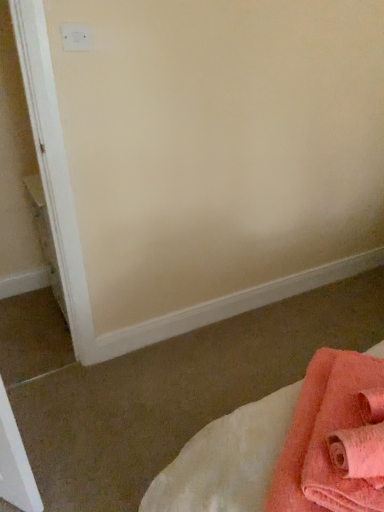
In order to click on soft coral towel at lower right in this screenshot , I will do `click(325, 438)`.

What is the approximate width of soft pink towel at lower right?

soft pink towel at lower right is 11.96 inches wide.

The width and height of the screenshot is (384, 512). In order to click on white plastic electric outlet at upper left in this screenshot , I will do `click(75, 37)`.

Does soft pink towel at lower right appear on the left side of soft coral towel at lower right?

No.

Considering the relative sizes of soft pink towel at lower right and soft coral towel at lower right in the image provided, is soft pink towel at lower right smaller than soft coral towel at lower right?

Correct, soft pink towel at lower right occupies less space than soft coral towel at lower right.

In the scene shown: From a real-world perspective, is soft pink towel at lower right physically above soft coral towel at lower right?

Indeed, from a real-world perspective, soft pink towel at lower right stands above soft coral towel at lower right.

Would you say soft pink towel at lower right is inside or outside soft coral towel at lower right?

soft pink towel at lower right is not enclosed by soft coral towel at lower right.

This screenshot has width=384, height=512. In order to click on towel in front of the white plastic electric outlet at upper left in this screenshot , I will do `click(325, 438)`.

From the image's perspective, between soft coral towel at lower right and white plastic electric outlet at upper left, who is located below?

soft coral towel at lower right is shown below in the image.

Does soft coral towel at lower right turn towards white plastic electric outlet at upper left?

No, soft coral towel at lower right does not turn towards white plastic electric outlet at upper left.

Does white plastic electric outlet at upper left have a greater height compared to soft coral towel at lower right?

No.

From a real-world perspective, is white plastic electric outlet at upper left on soft coral towel at lower right?

Yes, from a real-world perspective, white plastic electric outlet at upper left is above soft coral towel at lower right.

Considering their positions, is white plastic electric outlet at upper left located in front of or behind soft coral towel at lower right?

Clearly, white plastic electric outlet at upper left is behind soft coral towel at lower right.

I want to click on towel in front of the white plastic electric outlet at upper left, so click(325, 438).

In terms of size, does soft pink towel at lower right appear bigger or smaller than white plastic electric outlet at upper left?

In the image, soft pink towel at lower right appears to be larger than white plastic electric outlet at upper left.

Who is shorter, soft pink towel at lower right or white plastic electric outlet at upper left?

soft pink towel at lower right is shorter.

Is soft pink towel at lower right outside of white plastic electric outlet at upper left?

Absolutely, soft pink towel at lower right is external to white plastic electric outlet at upper left.

From a real-world perspective, who is located higher, soft coral towel at lower right or soft pink towel at lower right?

In real-world perspective, soft pink towel at lower right is above.

Between point (347, 509) and point (382, 451), which one is positioned behind?

The point (347, 509) is farther.

Considering the relative sizes of soft coral towel at lower right and soft pink towel at lower right in the image provided, is soft coral towel at lower right bigger than soft pink towel at lower right?

Indeed, soft coral towel at lower right has a larger size compared to soft pink towel at lower right.

Which of these two, soft coral towel at lower right or soft pink towel at lower right, stands shorter?

Standing shorter between the two is soft pink towel at lower right.

From a real-world perspective, is white plastic electric outlet at upper left over soft pink towel at lower right?

Yes, from a real-world perspective, white plastic electric outlet at upper left is on top of soft pink towel at lower right.

Could you tell me if white plastic electric outlet at upper left is facing soft pink towel at lower right?

Yes, white plastic electric outlet at upper left faces towards soft pink towel at lower right.

From the picture: From the image's perspective, is white plastic electric outlet at upper left positioned above or below soft pink towel at lower right?

Clearly, from the image's perspective, white plastic electric outlet at upper left is above soft pink towel at lower right.

What's the angular difference between white plastic electric outlet at upper left and soft pink towel at lower right's facing directions?

white plastic electric outlet at upper left and soft pink towel at lower right are facing 107 degrees away from each other.

Locate an element on the screen. The image size is (384, 512). bath towel above the soft coral towel at lower right (from the image's perspective) is located at coordinates (358, 451).

You are a GUI agent. You are given a task and a screenshot of the screen. Output one action in this format:
    pyautogui.click(x=<x>, y=<y>)
    Task: Click on the towel in front of the white plastic electric outlet at upper left
    This screenshot has width=384, height=512.
    Given the screenshot: What is the action you would take?
    pyautogui.click(x=325, y=438)

In the scene shown: When comparing their distances from soft coral towel at lower right, does soft pink towel at lower right or white plastic electric outlet at upper left seem further?

white plastic electric outlet at upper left.

Based on their spatial positions, is white plastic electric outlet at upper left or soft pink towel at lower right closer to soft coral towel at lower right?

soft pink towel at lower right.

Based on the photo, based on their spatial positions, is white plastic electric outlet at upper left or soft coral towel at lower right further from soft pink towel at lower right?

Among the two, white plastic electric outlet at upper left is located further to soft pink towel at lower right.

From the image, which object appears to be farther from white plastic electric outlet at upper left, soft coral towel at lower right or soft pink towel at lower right?

soft pink towel at lower right is further to white plastic electric outlet at upper left.

Estimate the real-world distances between objects in this image. Which object is further from soft pink towel at lower right, soft coral towel at lower right or white plastic electric outlet at upper left?

white plastic electric outlet at upper left.

Considering their positions, is soft pink towel at lower right positioned closer to white plastic electric outlet at upper left than soft coral towel at lower right?

soft coral towel at lower right is positioned closer to the anchor white plastic electric outlet at upper left.

Locate an element on the screen. bath towel between white plastic electric outlet at upper left and soft coral towel at lower right in the up-down direction is located at coordinates (358, 451).